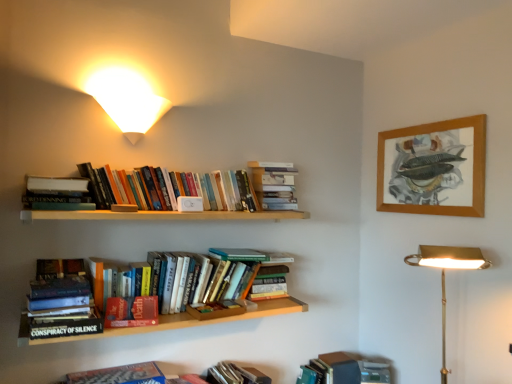
You are a GUI agent. You are given a task and a screenshot of the screen. Output one action in this format:
    pyautogui.click(x=<x>, y=<y>)
    Task: Click on the vacant space in white matte wall sconce at upper left, the 1th lamp when ordered from left to right (from a real-world perspective)
    This screenshot has height=384, width=512.
    Given the screenshot: What is the action you would take?
    pyautogui.click(x=130, y=368)